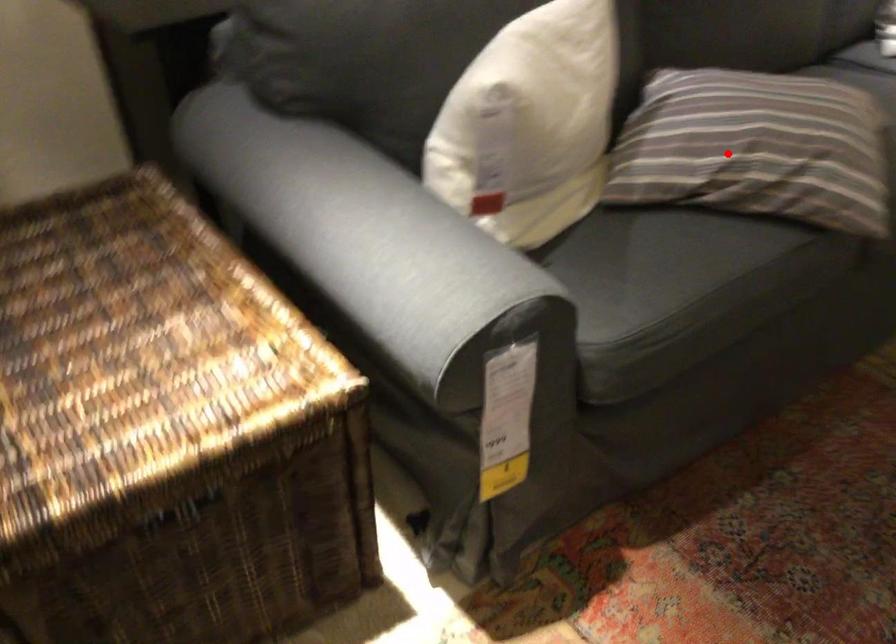
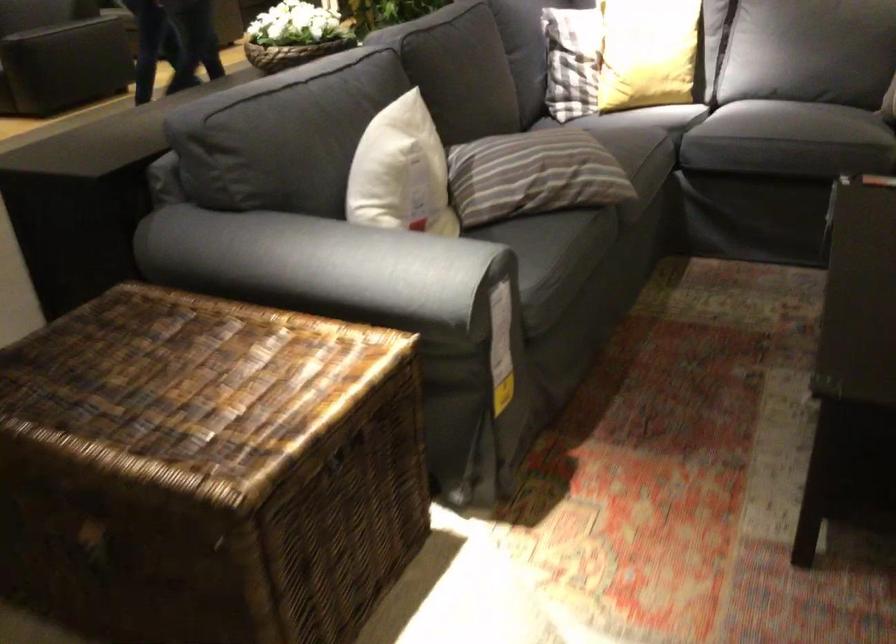
The point at the highlighted location is marked in the first image. Where is the corresponding point in the second image?

(533, 174)